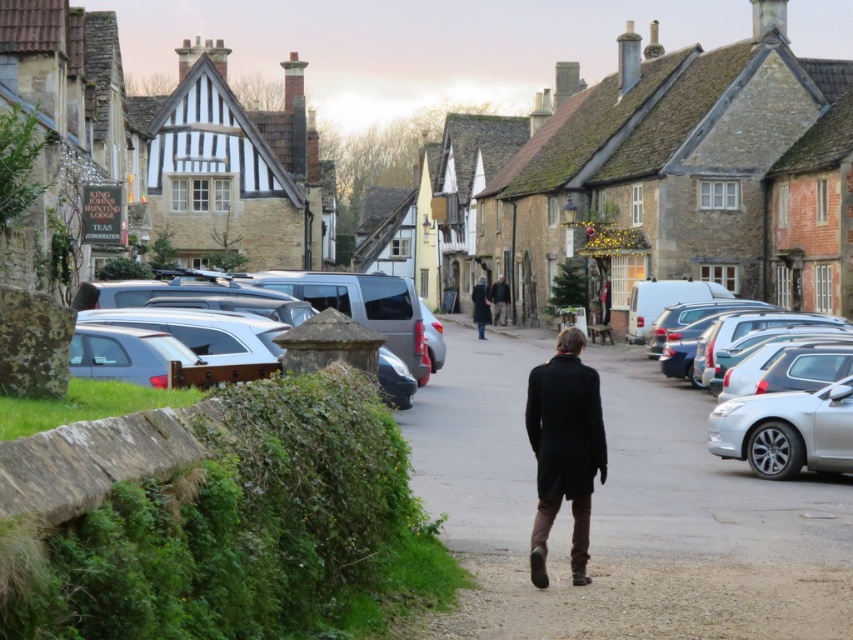
Question: Does stone village at center have a smaller size compared to dark brown leather coat at center?

Choices:
 (A) no
 (B) yes

Answer: (A)

Question: Considering the real-world distances, which object is farthest from the silver metallic car at right?

Choices:
 (A) silver metallic van at center-left
 (B) stone village at center

Answer: (B)

Question: Which object is farther from the camera taking this photo?

Choices:
 (A) dark brown leather coat at center
 (B) stone village at center
 (C) dark brown coat at center
 (D) silver metallic car at right

Answer: (A)

Question: Does stone village at center appear on the right side of silver metallic van at center-left?

Choices:
 (A) yes
 (B) no

Answer: (A)

Question: Does black wool coat at center come behind dark brown leather coat at center?

Choices:
 (A) no
 (B) yes

Answer: (A)

Question: Which of these objects is positioned farthest from the silver metallic van at center-left?

Choices:
 (A) silver metallic car at right
 (B) dark brown leather coat at center
 (C) green mossy hedge at lower left
 (D) stone village at center

Answer: (B)